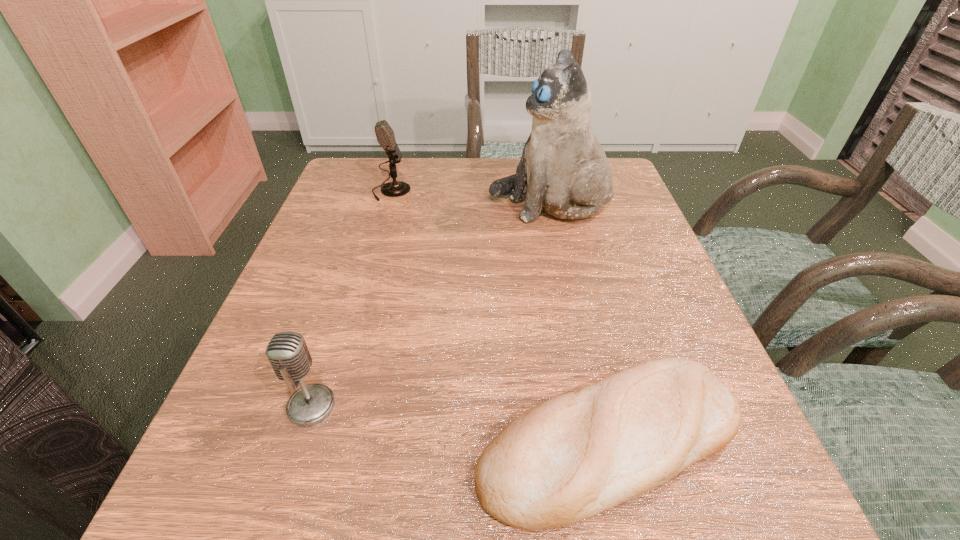
Locate an element on the screen. This screenshot has width=960, height=540. free space that is in between the farther microphone and the shortest object is located at coordinates (500, 316).

Locate an element on the screen. The width and height of the screenshot is (960, 540). free spot between the cat and the bread is located at coordinates (580, 322).

This screenshot has width=960, height=540. I want to click on empty space that is in between the farther microphone and the bread, so click(x=500, y=316).

Find the location of a particular element. vacant point located between the farther microphone and the nearer microphone is located at coordinates (351, 299).

Find the location of a particular element. vacant space that is in between the bread and the cat is located at coordinates (580, 322).

Find the location of a particular element. The height and width of the screenshot is (540, 960). vacant space in between the shortest object and the tallest object is located at coordinates (580, 322).

In order to click on free spot between the cat and the farther microphone in this screenshot , I will do [470, 198].

Choose which object is the second nearest neighbor to the farther microphone. Please provide its 2D coordinates. Your answer should be formatted as a tuple, i.e. [(x, y)], where the tuple contains the x and y coordinates of a point satisfying the conditions above.

[(569, 458)]

Locate which object is the second closest to the nearer microphone. Please provide its 2D coordinates. Your answer should be formatted as a tuple, i.e. [(x, y)], where the tuple contains the x and y coordinates of a point satisfying the conditions above.

[(563, 169)]

You are a GUI agent. You are given a task and a screenshot of the screen. Output one action in this format:
    pyautogui.click(x=<x>, y=<y>)
    Task: Click on the free space that satisfies the following two spatial constraints: 1. at the face of the tallest object; 2. on the right side of the shortest object
    This screenshot has height=540, width=960.
    Given the screenshot: What is the action you would take?
    pyautogui.click(x=600, y=441)